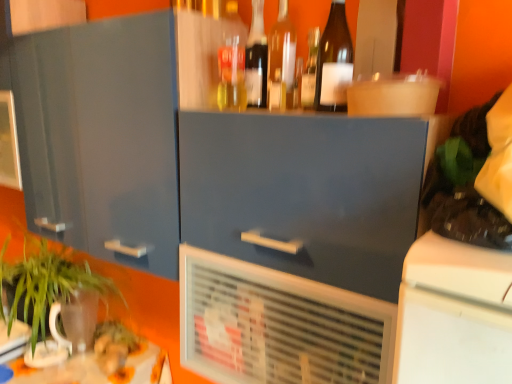
Question: Is matte gray cabinet at center, acting as the second cabinetry starting from the left, further to camera compared to white plastic air conditioning unit at center?

Choices:
 (A) yes
 (B) no

Answer: (B)

Question: Could you tell me if matte gray cabinet at center, acting as the second cabinetry starting from the left, is turned towards white plastic air conditioning unit at center?

Choices:
 (A) yes
 (B) no

Answer: (B)

Question: From the image's perspective, is matte gray cabinet at center, the 1th cabinetry in the right-to-left sequence, below white plastic air conditioning unit at center?

Choices:
 (A) yes
 (B) no

Answer: (B)

Question: Is matte gray cabinet at center, the 1th cabinetry in the right-to-left sequence, shorter than white plastic air conditioning unit at center?

Choices:
 (A) no
 (B) yes

Answer: (A)

Question: Is matte gray cabinet at center, the 1th cabinetry in the right-to-left sequence, not within white plastic air conditioning unit at center?

Choices:
 (A) no
 (B) yes

Answer: (B)

Question: Considering the positions of translucent glass bottle at center, arranged as the 2th bottle when viewed from the right, and green leafy plant at lower left in the image, is translucent glass bottle at center, arranged as the 2th bottle when viewed from the right, bigger or smaller than green leafy plant at lower left?

Choices:
 (A) small
 (B) big

Answer: (A)

Question: Does point (312, 54) appear closer or farther from the camera than point (39, 246)?

Choices:
 (A) closer
 (B) farther

Answer: (A)

Question: From the image's perspective, is translucent glass bottle at center, arranged as the 2th bottle when viewed from the right, located above or below green leafy plant at lower left?

Choices:
 (A) below
 (B) above

Answer: (B)

Question: Choose the correct answer: Is translucent glass bottle at center, arranged as the 2th bottle when viewed from the right, inside green leafy plant at lower left or outside it?

Choices:
 (A) inside
 (B) outside

Answer: (B)

Question: Is translucent glass bottle at upper center, the 4th bottle viewed from the right, bigger or smaller than transparent glass bottle at upper center, marked as the third bottle in a left-to-right arrangement?

Choices:
 (A) big
 (B) small

Answer: (A)

Question: Is point (248, 102) closer or farther from the camera than point (269, 72)?

Choices:
 (A) closer
 (B) farther

Answer: (B)

Question: Is translucent glass bottle at upper center, which ranks as the second bottle in left-to-right order, wider or thinner than transparent glass bottle at upper center, marked as the third bottle in a left-to-right arrangement?

Choices:
 (A) wide
 (B) thin

Answer: (A)

Question: From the image's perspective, is translucent glass bottle at upper center, the 4th bottle viewed from the right, above or below transparent glass bottle at upper center, marked as the third bottle in a left-to-right arrangement?

Choices:
 (A) above
 (B) below

Answer: (A)

Question: Is brown glass bottle at upper center, marked as the fifth bottle in a left-to-right arrangement, inside the boundaries of translucent glass bottle at center, arranged as the 2th bottle when viewed from the right, or outside?

Choices:
 (A) inside
 (B) outside

Answer: (B)

Question: From the image's perspective, is brown glass bottle at upper center, the 1th bottle in the right-to-left sequence, located above or below translucent glass bottle at center, marked as the fourth bottle in a left-to-right arrangement?

Choices:
 (A) above
 (B) below

Answer: (A)